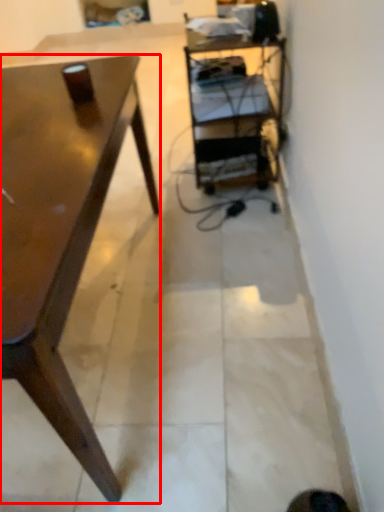
Question: From the image's perspective, what is the correct spatial relationship of desk (annotated by the red box) in relation to shelf?

Choices:
 (A) above
 (B) below

Answer: (B)